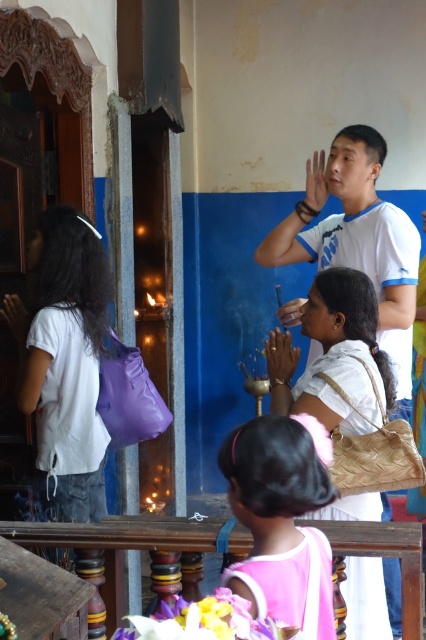
Is pink fabric dress at lower center further to the viewer compared to beige woven bag at center?

No, pink fabric dress at lower center is closer to the viewer.

Which is behind, point (247, 579) or point (360, 348)?

The point (360, 348) is behind.

In order to click on pink fabric dress at lower center in this screenshot , I will do `click(282, 520)`.